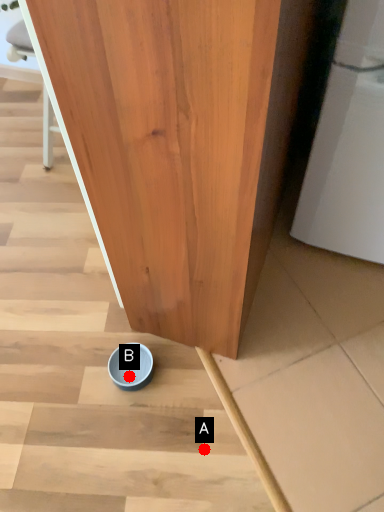
Question: Two points are circled on the image, labeled by A and B beside each circle. Which point appears farthest from the camera in this image?

Choices:
 (A) A is further
 (B) B is further

Answer: (B)